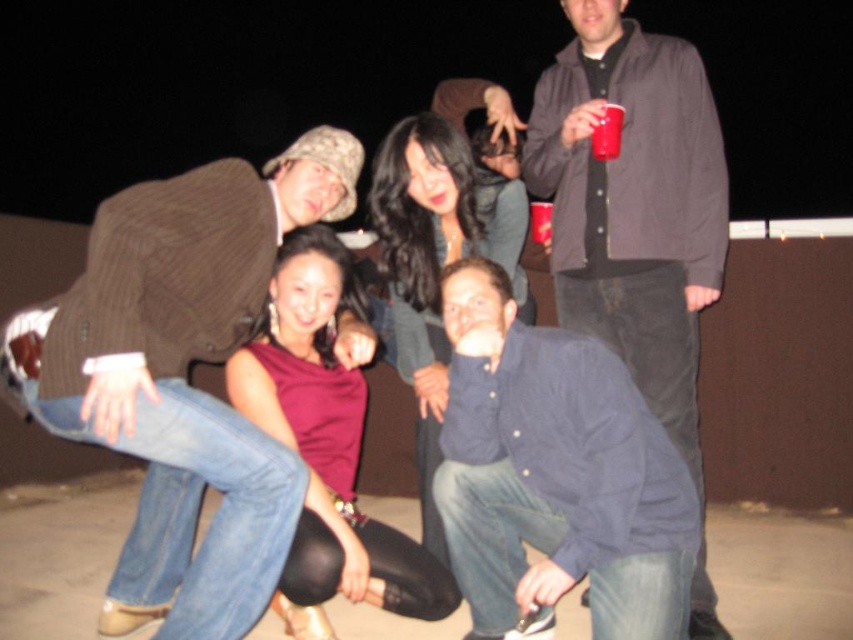
Question: Among these objects, which one is nearest to the camera?

Choices:
 (A) shiny black hair at center
 (B) dark gray jacket at upper right
 (C) matte plastic cup at upper center

Answer: (B)

Question: Which object is closer to the camera taking this photo?

Choices:
 (A) dark blue button-up shirt at lower center
 (B) shiny magenta dress at center

Answer: (A)

Question: Based on their relative distances, which object is farther from the matte plastic cup at upper center?

Choices:
 (A) dark blue button-up shirt at lower center
 (B) brown corduroy jacket at upper left
 (C) dark gray jacket at upper right
 (D) shiny black hair at center

Answer: (B)

Question: Can you confirm if shiny magenta dress at center is positioned below shiny black hair at center?

Choices:
 (A) no
 (B) yes

Answer: (B)

Question: Is brown corduroy jacket at upper left smaller than red plastic cup at upper center?

Choices:
 (A) no
 (B) yes

Answer: (A)

Question: Can you confirm if dark blue button-up shirt at lower center is positioned to the left of red plastic cup at upper center?

Choices:
 (A) yes
 (B) no

Answer: (A)